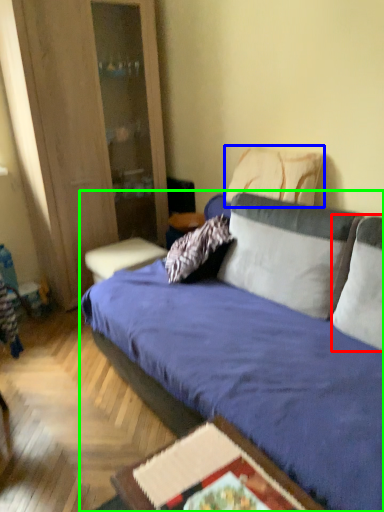
Question: Based on their relative distances, which object is farther from pillow (highlighted by a red box)? Choose from pillow (highlighted by a blue box) and studio couch (highlighted by a green box).

Choices:
 (A) pillow
 (B) studio couch

Answer: (A)